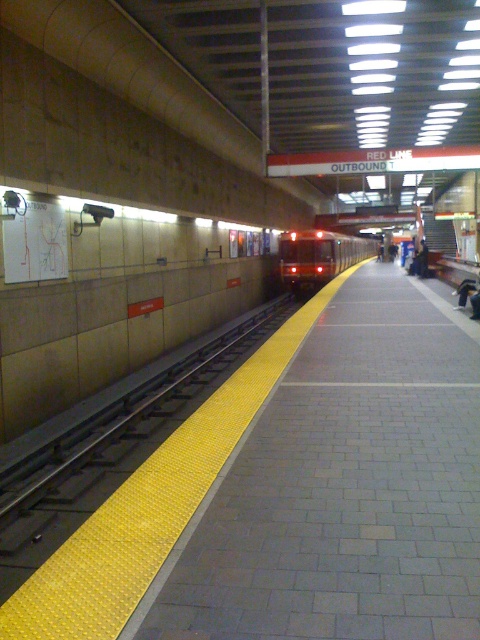
You are a passenger waiting for the Red Line Outbound train. You see the yellow textured platform at center and the red glossy train at center. Which one is larger in size?

The red glossy train at center is larger than the yellow textured platform at center.

You are a passenger waiting for the Red Line Outbound train. You see the yellow textured platform at center and the red glossy train at center. Which object is closer to the tracks?

The yellow textured platform at center is positioned on the left side of the red glossy train at center, so the yellow textured platform at center is closer to the tracks.

You are standing on the Red Line Outbound subway platform and want to know how far the point at coordinates [399,272] is from you. Can you determine the distance?

The point at coordinates [399,272] is 37.16 meters away from you.